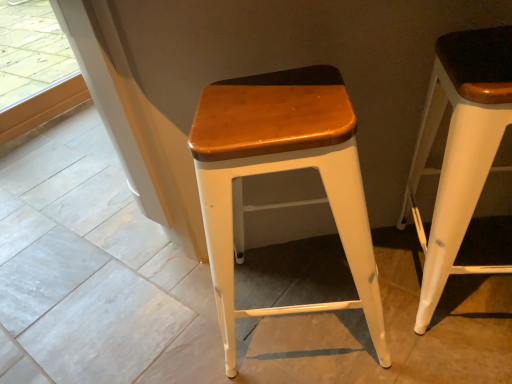
Question: Which is correct: white matte wood stool at right, acting as the second stool starting from the left, is inside wooden seat at center, the first stool from the left, or outside of it?

Choices:
 (A) outside
 (B) inside

Answer: (A)

Question: From the image's perspective, is white matte wood stool at right, acting as the second stool starting from the left, above or below wooden seat at center, the first stool from the left?

Choices:
 (A) below
 (B) above

Answer: (B)

Question: Is point (477, 105) positioned closer to the camera than point (256, 172)?

Choices:
 (A) farther
 (B) closer

Answer: (B)

Question: In the image, is wooden seat at center, the first stool from the left, positioned in front of or behind white matte wood stool at right, acting as the second stool starting from the left?

Choices:
 (A) behind
 (B) front

Answer: (A)

Question: Would you say wooden seat at center, the 2th stool from the right, is to the left or to the right of white matte wood stool at right, acting as the second stool starting from the left, in the picture?

Choices:
 (A) left
 (B) right

Answer: (A)

Question: From the image's perspective, is wooden seat at center, the first stool from the left, positioned above or below white matte wood stool at right, acting as the second stool starting from the left?

Choices:
 (A) below
 (B) above

Answer: (A)

Question: From a real-world perspective, is wooden seat at center, the 2th stool from the right, positioned above or below white matte wood stool at right, acting as the second stool starting from the left?

Choices:
 (A) below
 (B) above

Answer: (A)